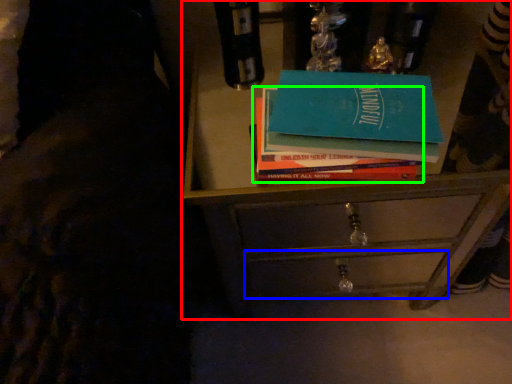
Question: Which object is the farthest from chest of drawers (highlighted by a red box)? Choose among these: drawer (highlighted by a blue box) or book (highlighted by a green box).

Choices:
 (A) drawer
 (B) book

Answer: (B)